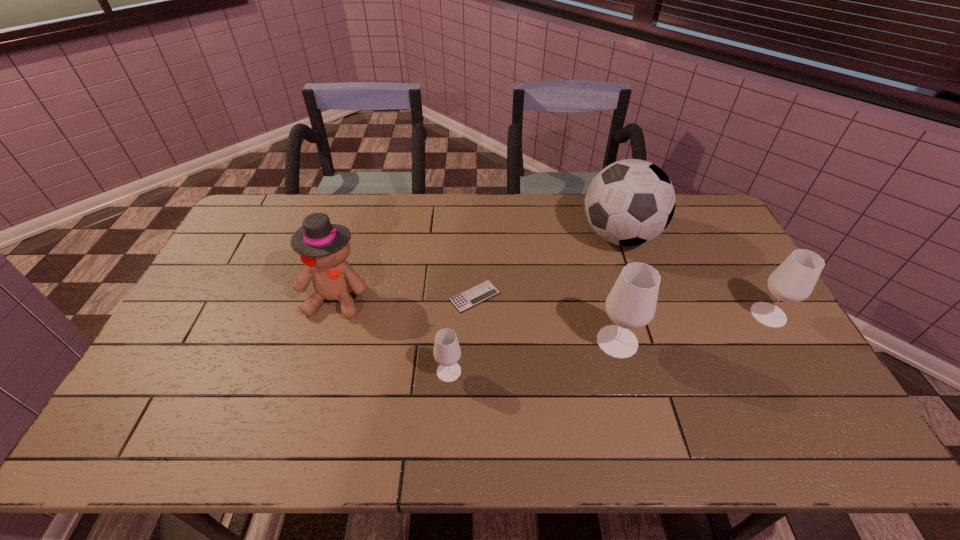
The width and height of the screenshot is (960, 540). Identify the location of empty space between the nearest object and the second glass from right to left. (533, 356).

The width and height of the screenshot is (960, 540). I want to click on free space between the shortest object and the rag_doll, so click(x=406, y=296).

Locate which object ranks in proximity to the calculator. Please provide its 2D coordinates. Your answer should be formatted as a tuple, i.e. [(x, y)], where the tuple contains the x and y coordinates of a point satisfying the conditions above.

[(447, 352)]

Find the location of a particular element. object that stands as the closest to the soccer ball is located at coordinates (793, 281).

Where is `glass that can be found as the closest to the second glass from left to right`? This screenshot has width=960, height=540. glass that can be found as the closest to the second glass from left to right is located at coordinates (793, 281).

Locate which glass is the second closest to the rightmost object. Please provide its 2D coordinates. Your answer should be formatted as a tuple, i.e. [(x, y)], where the tuple contains the x and y coordinates of a point satisfying the conditions above.

[(447, 352)]

Identify the location of free location that satisfies the following two spatial constraints: 1. on the main logo of the soccer ball; 2. on the front side of the second glass from left to right. (655, 341).

The height and width of the screenshot is (540, 960). Find the location of `vacant region that satisfies the following two spatial constraints: 1. on the front side of the second glass from left to right; 2. on the right side of the calculator`. vacant region that satisfies the following two spatial constraints: 1. on the front side of the second glass from left to right; 2. on the right side of the calculator is located at coordinates (474, 341).

The image size is (960, 540). Find the location of `free point that satisfies the following two spatial constraints: 1. on the front-facing side of the nearest glass; 2. on the left side of the leftmost object`. free point that satisfies the following two spatial constraints: 1. on the front-facing side of the nearest glass; 2. on the left side of the leftmost object is located at coordinates (315, 372).

The height and width of the screenshot is (540, 960). Find the location of `vacant space that satisfies the following two spatial constraints: 1. on the main logo of the farthest object; 2. on the front side of the leftmost glass`. vacant space that satisfies the following two spatial constraints: 1. on the main logo of the farthest object; 2. on the front side of the leftmost glass is located at coordinates (665, 372).